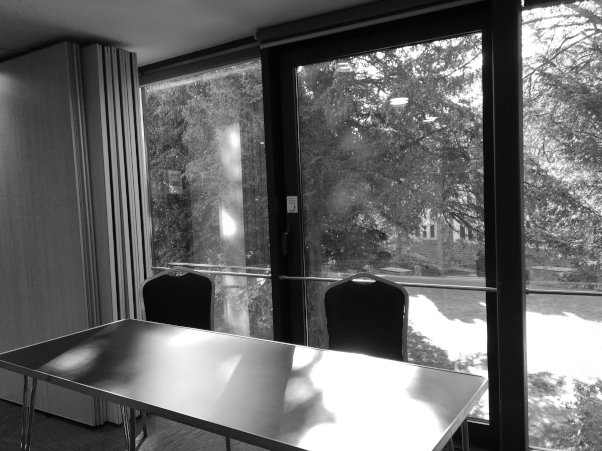
What are the coordinates of `left top window glass` in the screenshot? It's located at (203, 146).